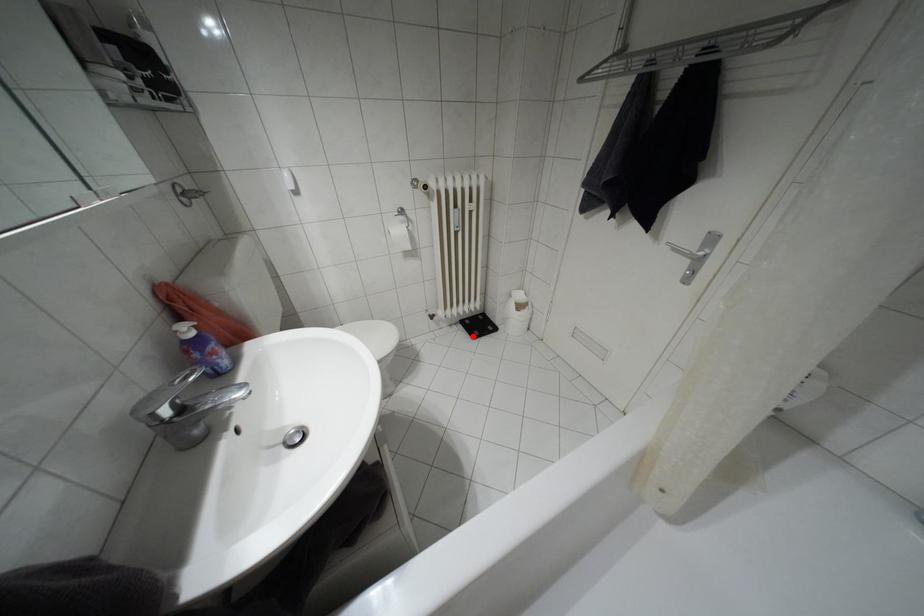
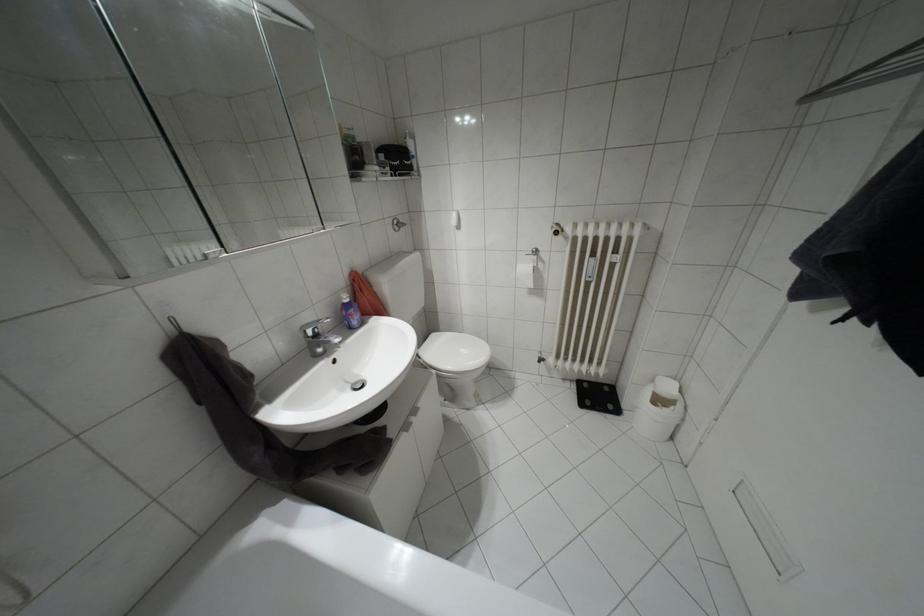
Where in the second image is the point corresponding to the highlighted location from the first image?

(580, 405)